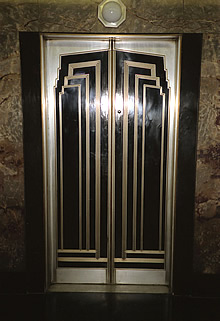
Locate an element on the screen. slight reflection of the elevator door on the floor is located at coordinates (101, 297), (116, 296), (55, 298).